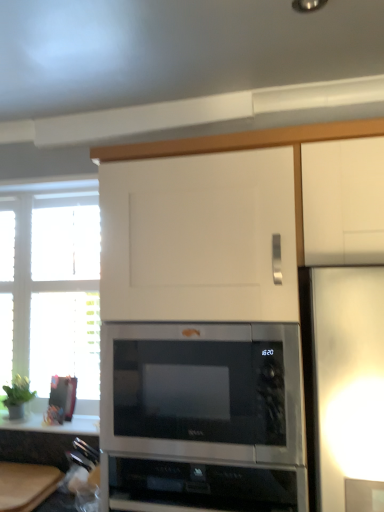
Find the location of a particular element. Image resolution: width=384 pixels, height=512 pixels. free space above white glossy countertop at lower left (from a real-world perspective) is located at coordinates (41, 421).